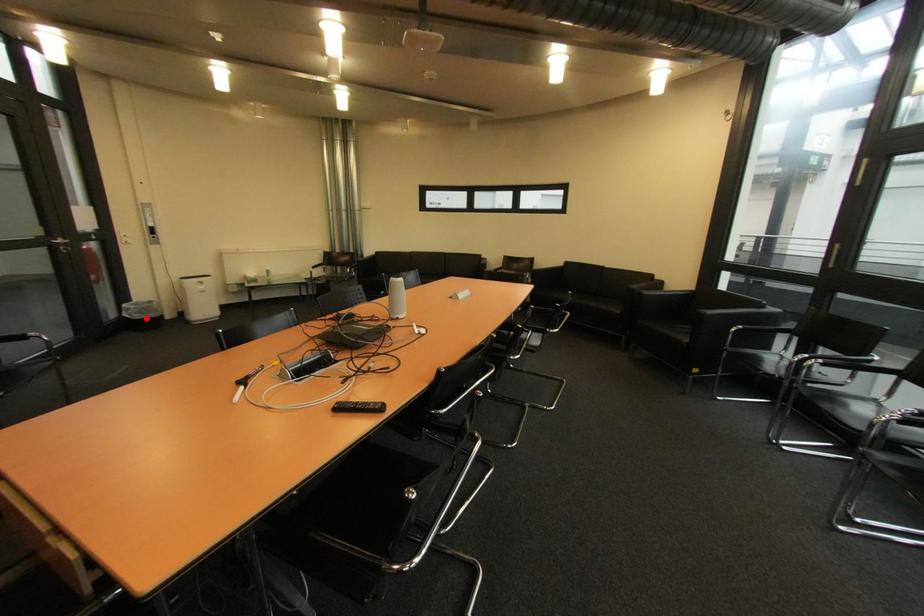
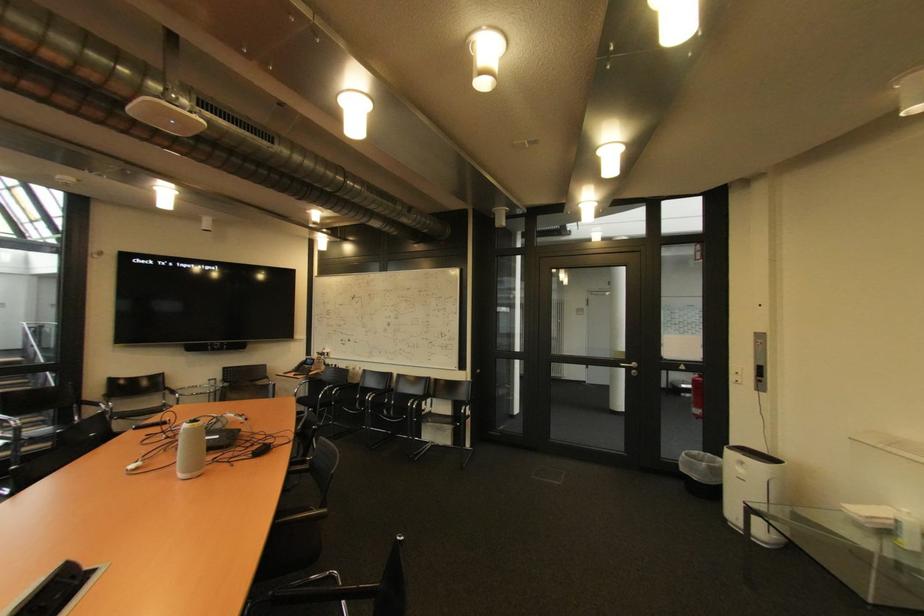
Locate, in the second image, the point that corresponds to the highlighted location in the first image.

(690, 471)